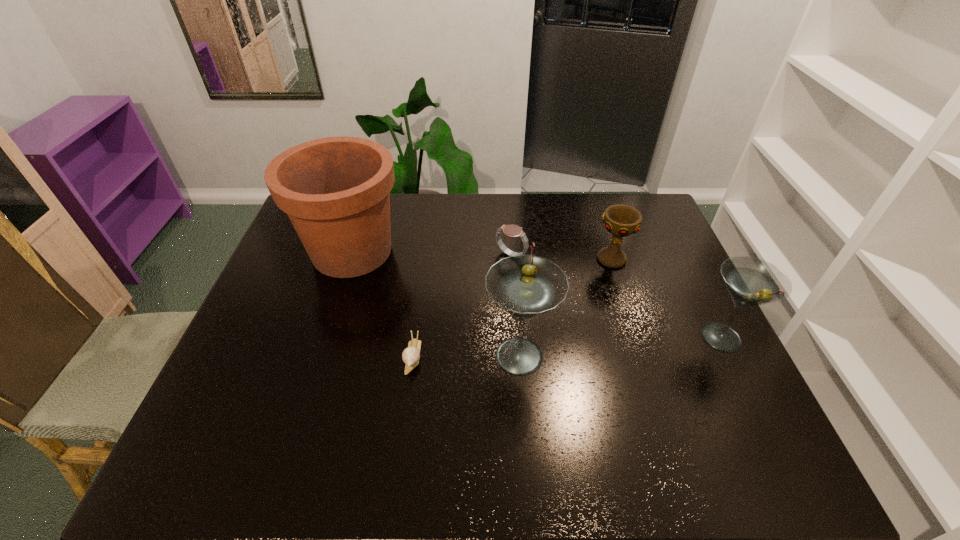
Identify the location of free point located on the left of the fourth shortest object. (553, 338).

Where is `vacant space situated on the back of the leftmost object`? The image size is (960, 540). vacant space situated on the back of the leftmost object is located at coordinates (368, 201).

Find the location of `vacant space located 0.330m on the right of the watch`. vacant space located 0.330m on the right of the watch is located at coordinates (631, 255).

Where is `free spot located on the front of the fourth tallest object`? free spot located on the front of the fourth tallest object is located at coordinates 631,316.

I want to click on vacant space located on the shell of the shortest object, so click(406, 409).

Image resolution: width=960 pixels, height=540 pixels. I want to click on object present at the far edge, so click(x=336, y=190).

At what (x,y) coordinates should I click in order to perform the action: click on object that is positioned at the left edge. Please return your answer as a coordinate pair (x, y). The width and height of the screenshot is (960, 540). Looking at the image, I should click on (336, 190).

Identify the location of martini located in the right edge section of the desktop. (750, 281).

At what (x,y) coordinates should I click in order to perform the action: click on chalice at the right edge. Please return your answer as a coordinate pair (x, y). Looking at the image, I should click on (620, 220).

Find the location of a particular element. object that is positioned at the far left corner is located at coordinates (336, 190).